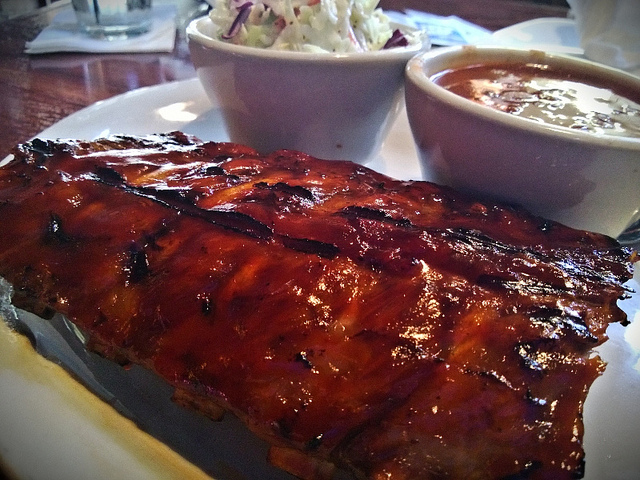
This screenshot has width=640, height=480. What are the coordinates of `glass of water` in the screenshot? It's located at (108, 11).